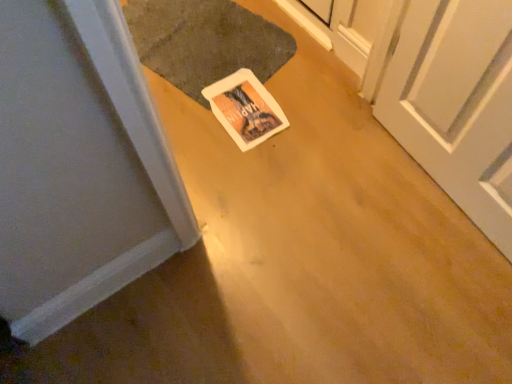
This screenshot has height=384, width=512. I want to click on empty space that is ontop of white paper postcard at center (from a real-world perspective), so click(x=247, y=105).